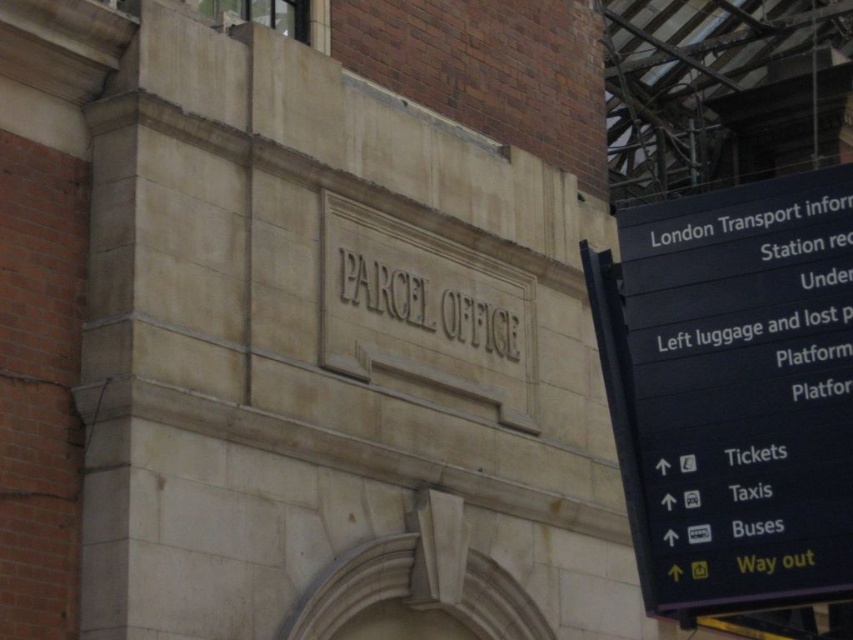
Question: Can you confirm if black plastic sign at right is smaller than matte stone sign at center?

Choices:
 (A) yes
 (B) no

Answer: (B)

Question: Can you confirm if black plastic sign at right is positioned to the left of matte stone sign at center?

Choices:
 (A) yes
 (B) no

Answer: (B)

Question: Which object is farther from the camera taking this photo?

Choices:
 (A) matte stone sign at center
 (B) black plastic sign at right

Answer: (A)

Question: Among these points, which one is nearest to the camera?

Choices:
 (A) (502, 307)
 (B) (654, 323)

Answer: (B)

Question: Considering the relative positions of black plastic sign at right and matte stone sign at center in the image provided, where is black plastic sign at right located with respect to matte stone sign at center?

Choices:
 (A) above
 (B) below

Answer: (B)